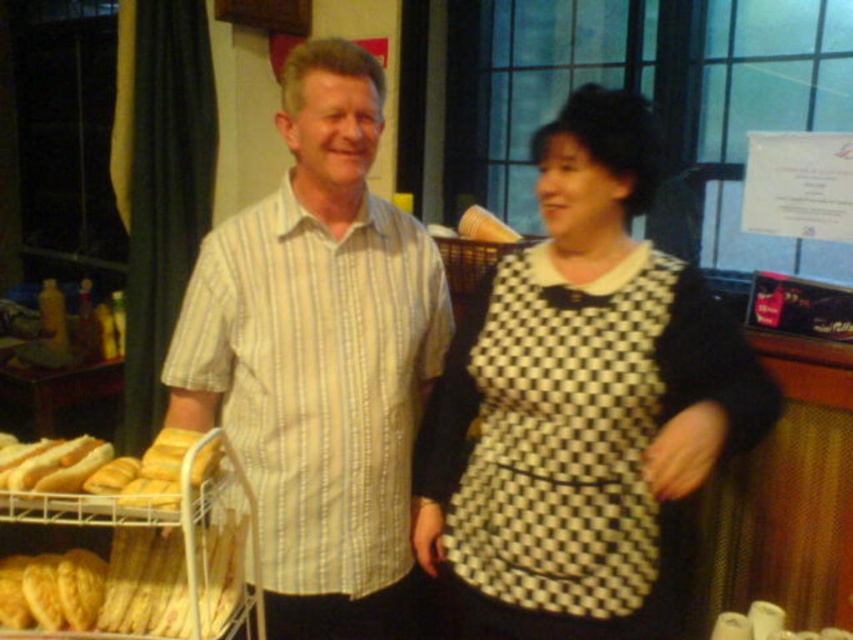
Question: Does black and white checkered apron at center have a larger size compared to metallic silver cart at lower left?

Choices:
 (A) no
 (B) yes

Answer: (A)

Question: Which of the following is the farthest from the observer?

Choices:
 (A) (640, 285)
 (B) (299, 579)
 (C) (151, 529)

Answer: (B)

Question: Does black checkered dress at center appear on the left side of metallic silver cart at lower left?

Choices:
 (A) yes
 (B) no

Answer: (B)

Question: Considering the real-world distances, which object is farthest from the black and white checkered apron at center?

Choices:
 (A) metallic silver cart at lower left
 (B) yellow striped shirt at center
 (C) black checkered dress at center

Answer: (A)

Question: In this image, where is black checkered dress at center located relative to yellow striped shirt at center?

Choices:
 (A) right
 (B) left

Answer: (A)

Question: Which object is the farthest from the black checkered dress at center?

Choices:
 (A) black and white checkered apron at center
 (B) metallic silver cart at lower left
 (C) yellow striped shirt at center

Answer: (B)